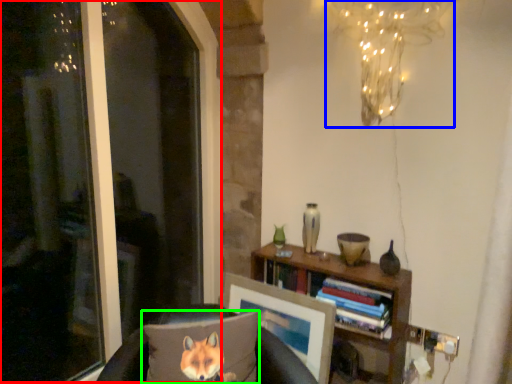
Question: Considering the real-world distances, which object is farthest from window screen (highlighted by a red box)? lamp (highlighted by a blue box) or pillow (highlighted by a green box)?

Choices:
 (A) lamp
 (B) pillow

Answer: (A)